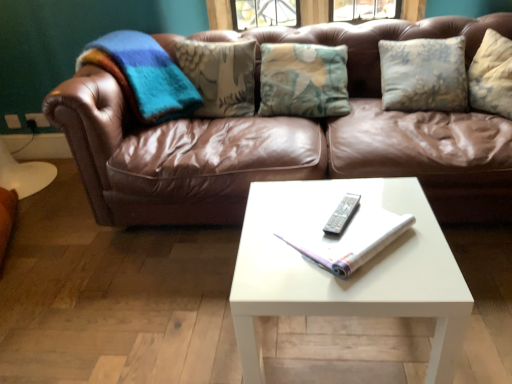
Identify the location of free space above white glossy coffee table at center (from a real-world perspective). (331, 234).